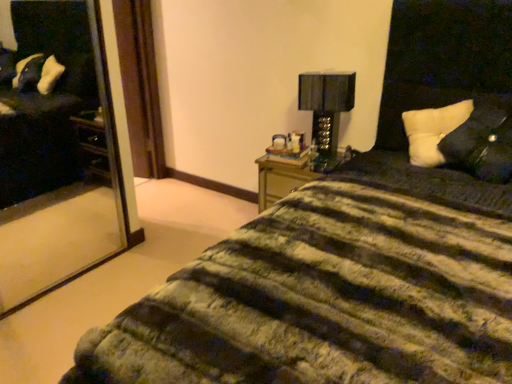
Question: From their relative heights in the image, would you say white soft pillow at upper right, which is the second pillow from front to back, is taller or shorter than white soft pillow at right, placed as the 2th pillow when sorted from back to front?

Choices:
 (A) tall
 (B) short

Answer: (B)

Question: Is white soft pillow at upper right, the first pillow when ordered from back to front, in front of or behind white soft pillow at right, placed as the 2th pillow when sorted from back to front, in the image?

Choices:
 (A) front
 (B) behind

Answer: (B)

Question: Which is farther from the white soft pillow at right, placed as the 2th pillow when sorted from back to front?

Choices:
 (A) black glossy table lamp at upper right
 (B) white soft pillow at upper right, the first pillow when ordered from back to front

Answer: (A)

Question: Estimate the real-world distances between objects in this image. Which object is closer to the white soft pillow at right, which appears as the 1th pillow when viewed from the front?

Choices:
 (A) black glossy table lamp at upper right
 (B) white soft pillow at upper right, which is the second pillow from front to back

Answer: (B)